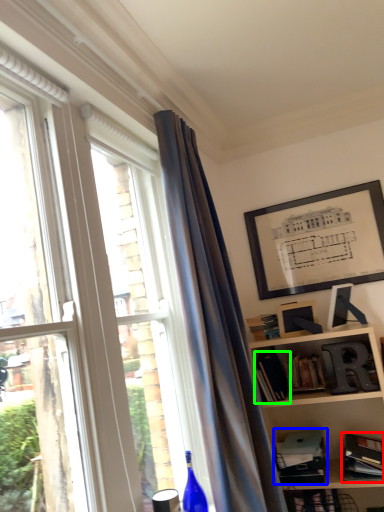
Question: Based on their relative distances, which object is nearer to book (highlighted by a red box)? Choose from paperback book (highlighted by a blue box) and book (highlighted by a green box).

Choices:
 (A) paperback book
 (B) book

Answer: (A)